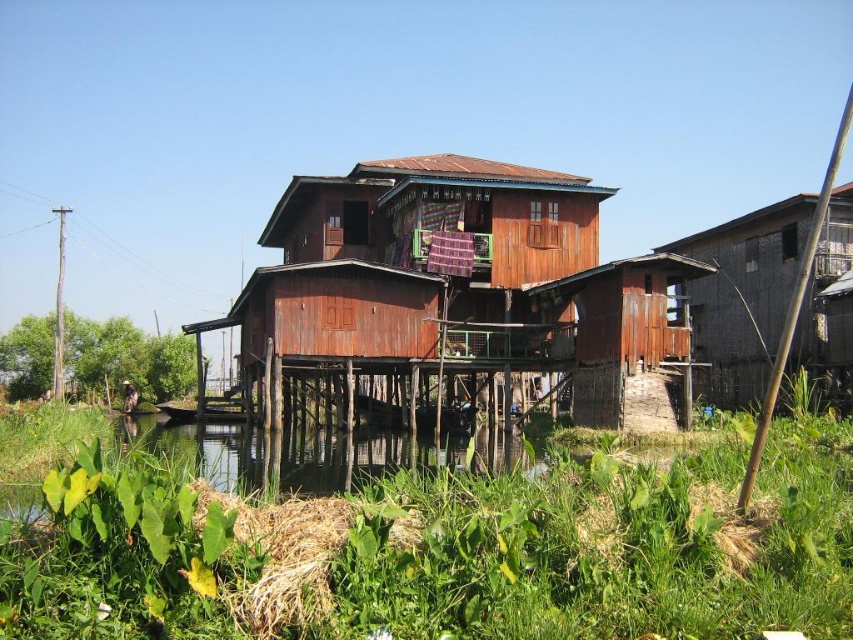
Who is more forward, (599, 340) or (213, 449)?

Point (599, 340) is more forward.

Is point (352, 250) more distant than point (306, 429)?

No, (352, 250) is closer to viewer.

The width and height of the screenshot is (853, 640). What are the coordinates of `rusty wood house at center` in the screenshot? It's located at (453, 282).

Between point (730, 321) and point (242, 436), which one is positioned in front?

Positioned in front is point (242, 436).

Does wooden hut at right have a smaller size compared to green grassy river at lower left?

Indeed, wooden hut at right has a smaller size compared to green grassy river at lower left.

Is point (782, 304) less distant than point (346, 449)?

No, it is behind (346, 449).

Identify the location of wooden hut at right. (743, 296).

Who is more distant from viewer, (577, 285) or (796, 344)?

The point (796, 344) is more distant.

Can you confirm if rusty wood house at center is positioned above wooden hut at right?

Indeed, rusty wood house at center is positioned over wooden hut at right.

Does point (450, 346) come farther from viewer compared to point (811, 339)?

No, it is not.

This screenshot has height=640, width=853. In order to click on rusty wood house at center in this screenshot , I will do coord(453,282).